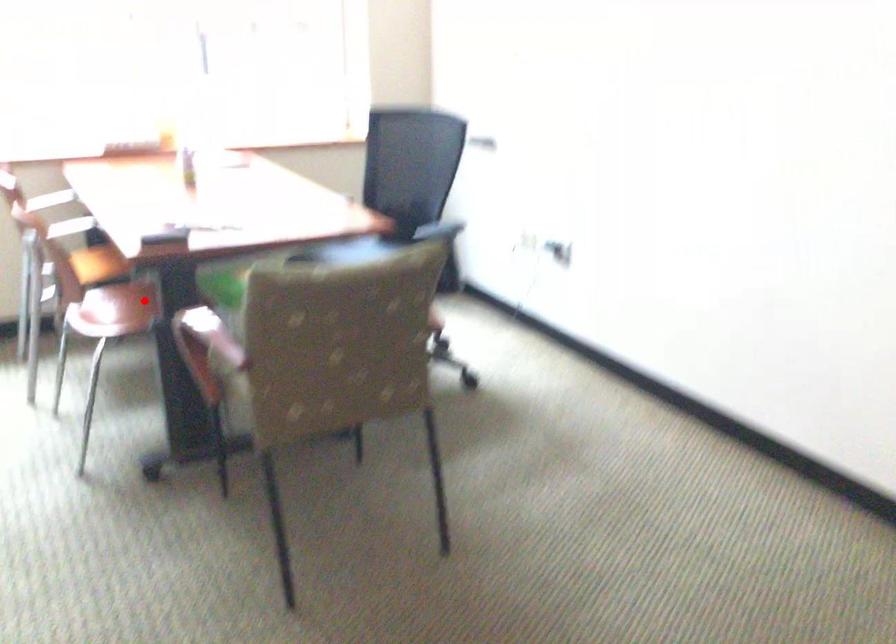
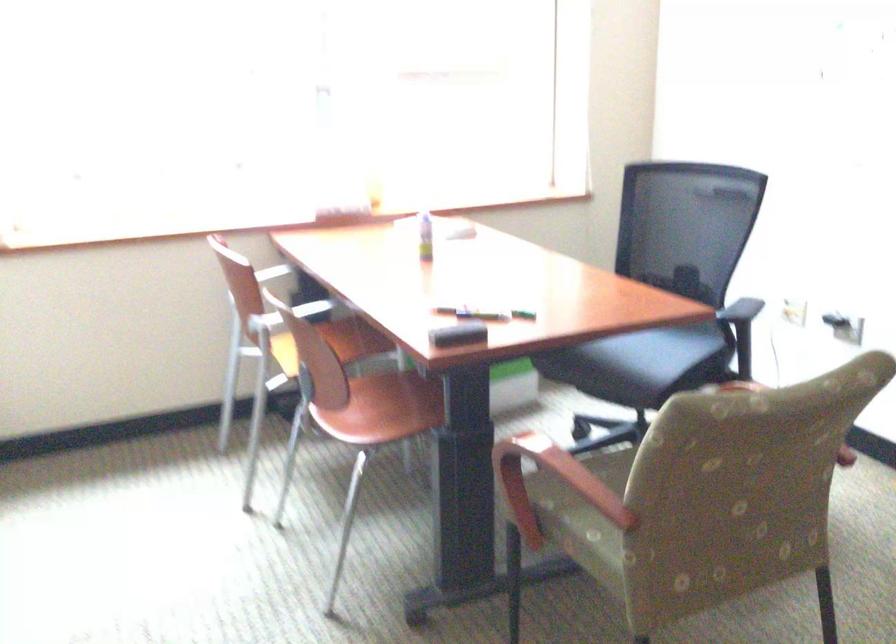
Where in the second image is the point corresponding to the highlighted location from the first image?

(391, 406)